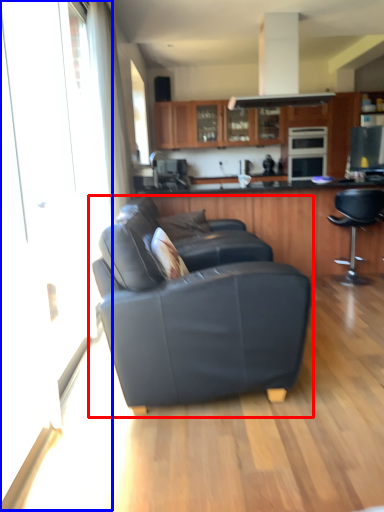
Question: Which object is further to the camera taking this photo, studio couch (highlighted by a red box) or screen door (highlighted by a blue box)?

Choices:
 (A) studio couch
 (B) screen door

Answer: (A)